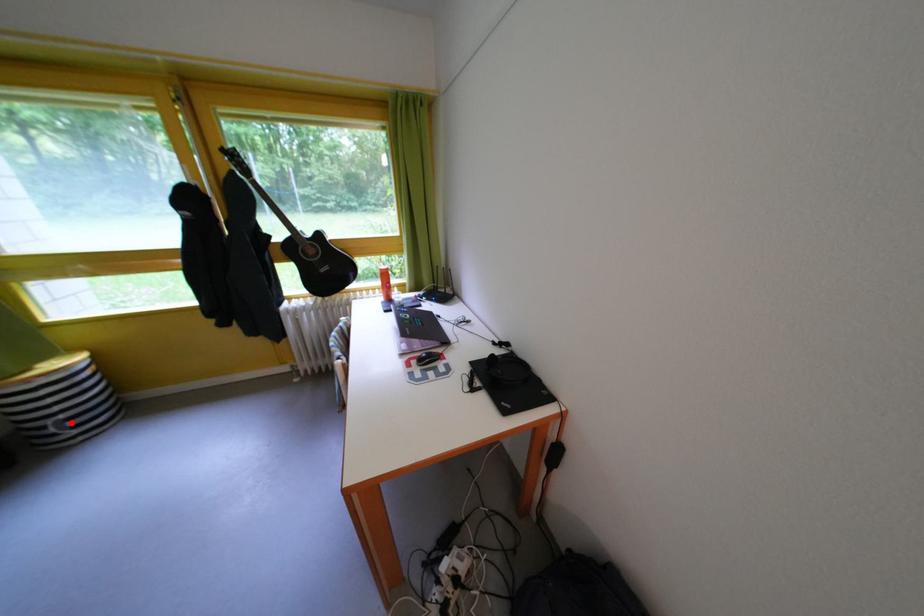
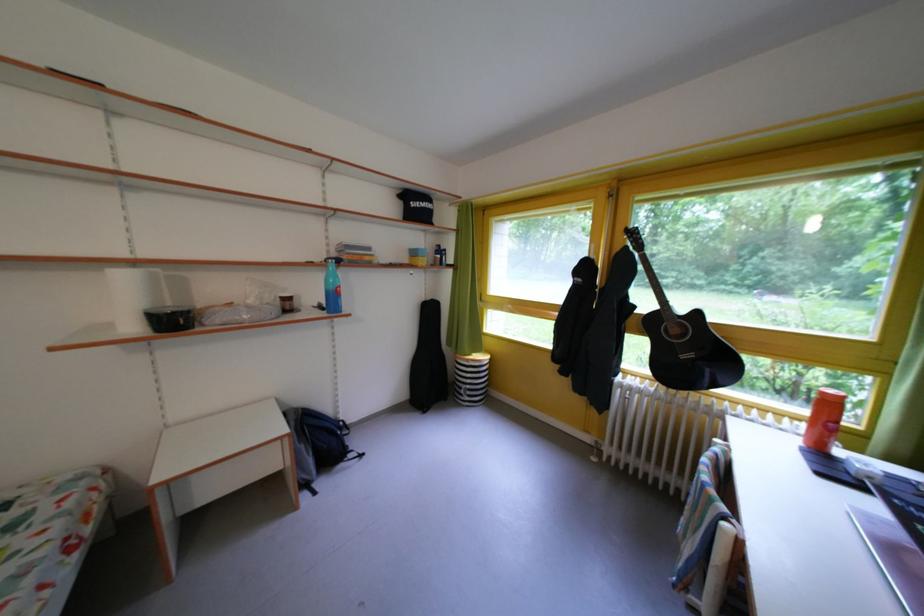
Question: I am providing you with two images of the same scene from different viewpoints. A red point is shown in image1. For the corresponding object point in image2, is it positioned nearer or farther from the camera?

Choices:
 (A) Nearer
 (B) Farther

Answer: (B)